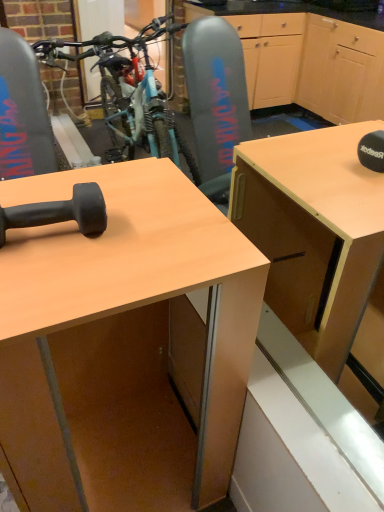
You are a GUI agent. You are given a task and a screenshot of the screen. Output one action in this format:
    pyautogui.click(x=<x>, y=<y>)
    Task: Click on the vacant area that is situated to the right of black rubber dumbbell at lower left
    
    Given the screenshot: What is the action you would take?
    pyautogui.click(x=134, y=239)